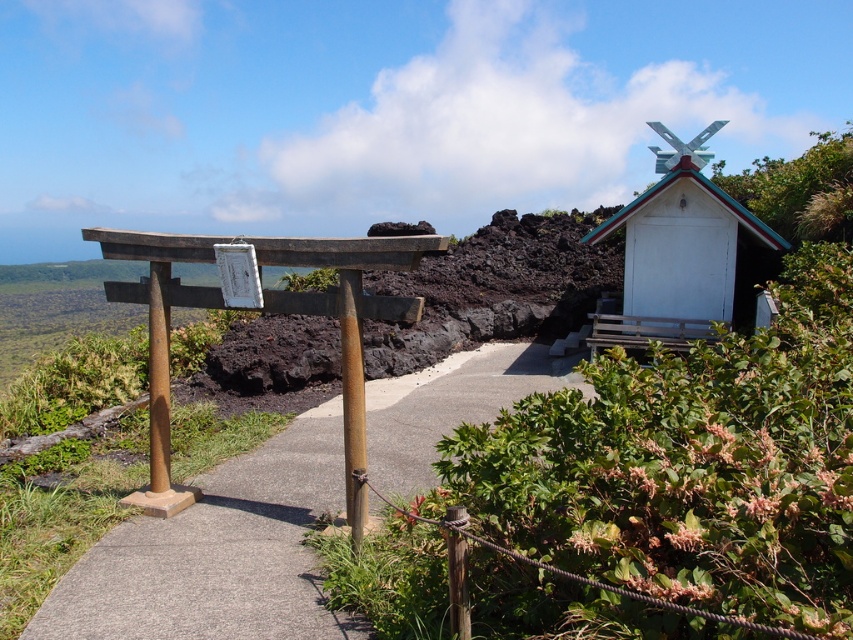
Question: Does concrete at center come behind white wooden shrine at upper right?

Choices:
 (A) yes
 (B) no

Answer: (B)

Question: Among these points, which one is farthest from the camera?

Choices:
 (A) (292, 616)
 (B) (607, 326)

Answer: (B)

Question: Which object is farther from the camera taking this photo?

Choices:
 (A) concrete at center
 (B) white wooden shrine at upper right

Answer: (B)

Question: Can you confirm if concrete at center is smaller than white wooden shrine at upper right?

Choices:
 (A) yes
 (B) no

Answer: (B)

Question: Is concrete at center bigger than white wooden shrine at upper right?

Choices:
 (A) no
 (B) yes

Answer: (B)